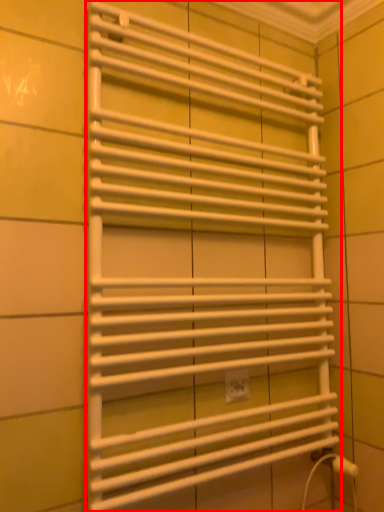
Question: Where is towel rack (annotated by the red box) located in relation to electric outlet in the image?

Choices:
 (A) right
 (B) left

Answer: (B)